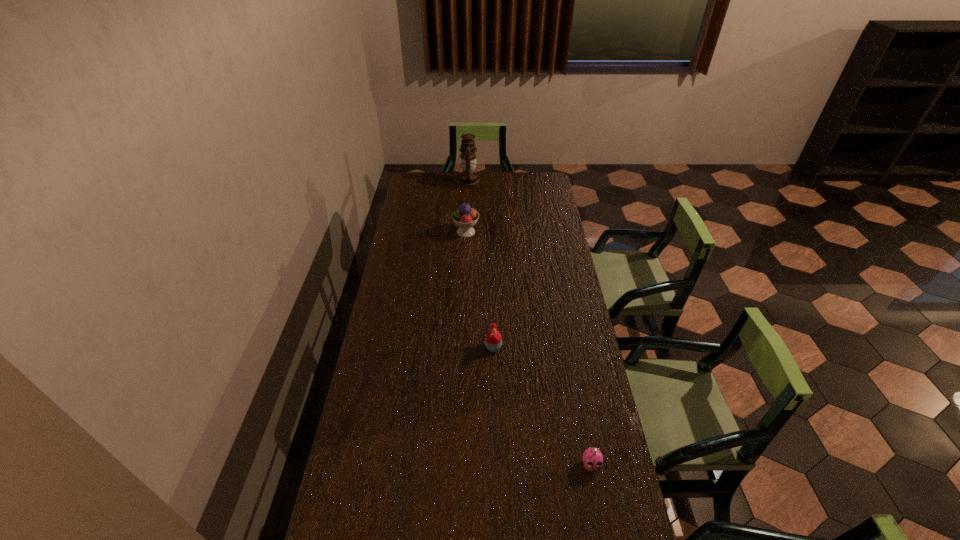
I want to click on lantern, so click(x=468, y=178).

Image resolution: width=960 pixels, height=540 pixels. Identify the location of the tallest object. (468, 178).

This screenshot has height=540, width=960. I want to click on the third nearest object, so click(x=465, y=217).

The height and width of the screenshot is (540, 960). Find the location of `the third shortest object`. the third shortest object is located at coordinates (465, 217).

Locate an element on the screen. This screenshot has height=540, width=960. the second object from right to left is located at coordinates (493, 341).

Find the location of `the second nearest object`. the second nearest object is located at coordinates (493, 341).

I want to click on the nearest object, so click(x=592, y=458).

The height and width of the screenshot is (540, 960). I want to click on the nearer cupcake, so click(592, 458).

Identify the location of vacant region located 0.120m on the right of the farthest object. (500, 182).

Find the location of `vacant space located 0.230m on the left of the second tallest object`. vacant space located 0.230m on the left of the second tallest object is located at coordinates (406, 232).